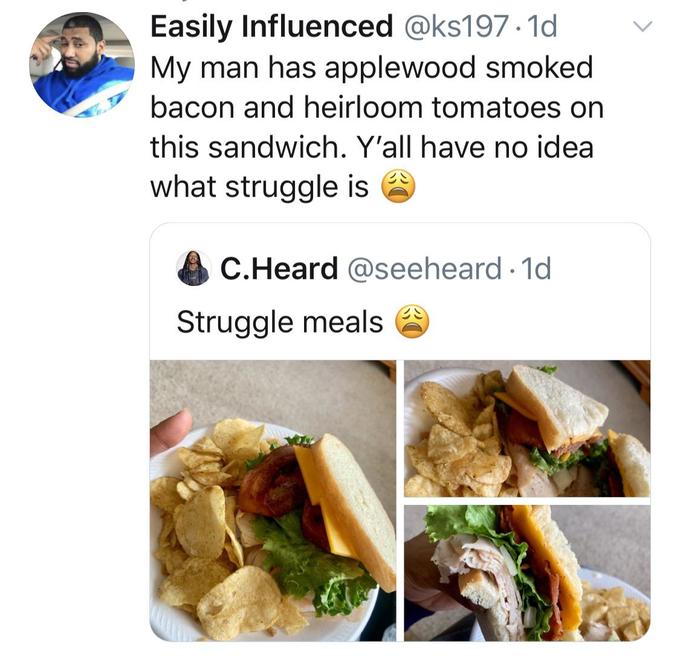
Locate an element on the screen. This screenshot has width=680, height=656. plate is located at coordinates (445, 377), (169, 462), (591, 579).